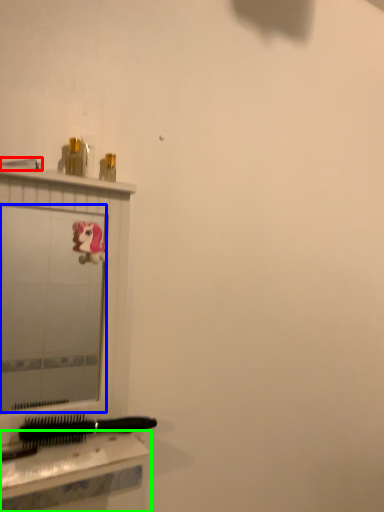
Question: Estimate the real-world distances between objects in this image. Which object is closer to shower (highlighted by a red box), mirror (highlighted by a blue box) or table (highlighted by a green box)?

Choices:
 (A) mirror
 (B) table

Answer: (B)